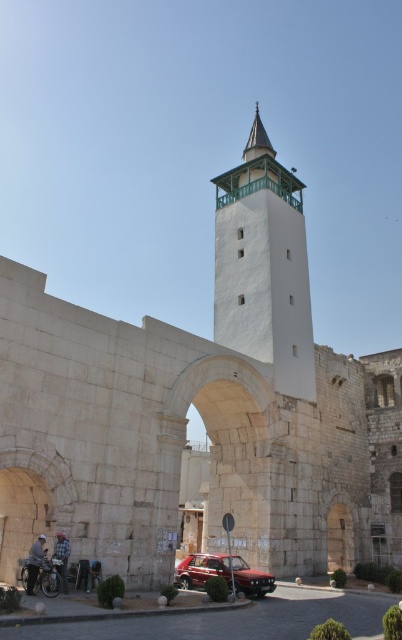
From the picture: You are a tour guide explaining the historical site to visitors. You want to mention the distance between the shiny chrome motorcycle at lower left and the light blue denim jacket at lower left. What would you say?

The distance between the shiny chrome motorcycle at lower left and the light blue denim jacket at lower left is 16.77 inches.

You are a tourist visiting the historical site and want to take a photo of the tall, white minaret with its green decorative band. You have a shiny chrome motorcycle at lower left and a light blue denim jacket at lower left in your view. Which object is closer to the camera so that it doesn not block the minaret?

The shiny chrome motorcycle at lower left is smaller than the light blue denim jacket at lower left, indicating it is farther away. Therefore, the light blue denim jacket at lower left is closer to the camera and might block the view of the minaret.

You are standing in front of the historical structure and see the white stone minaret at center and the blue plaid shirt at lower left. Which object is higher in the image?

The white stone minaret at center is higher than the blue plaid shirt at lower left because it is positioned above it in the image.